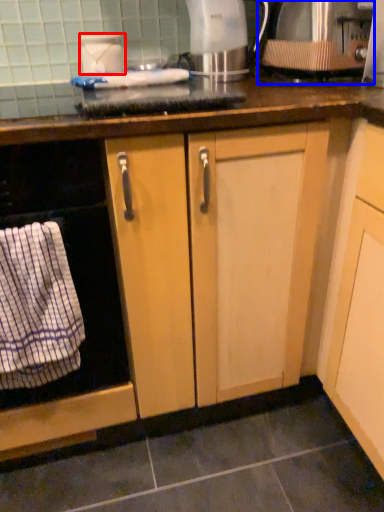
Question: Which object appears closest to the camera in this image, kitchen appliance (highlighted by a red box) or kitchen appliance (highlighted by a blue box)?

Choices:
 (A) kitchen appliance
 (B) kitchen appliance

Answer: (B)